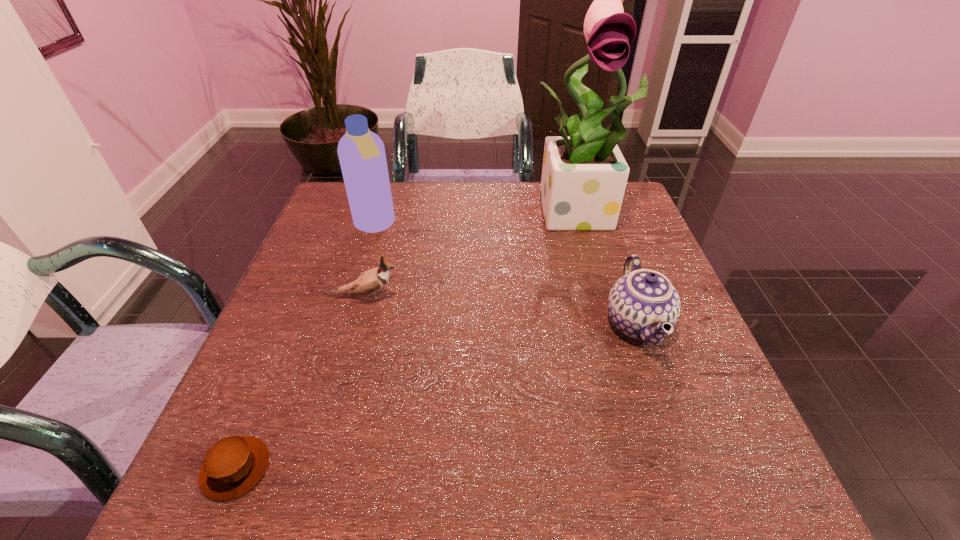
Locate an element on the screen. The height and width of the screenshot is (540, 960). free spot that satisfies the following two spatial constraints: 1. on the front-facing side of the tallest object; 2. at the face of the bird is located at coordinates (609, 296).

Where is `blank space that satisfies the following two spatial constraints: 1. at the face of the bird; 2. on the front side of the shortest object`? The width and height of the screenshot is (960, 540). blank space that satisfies the following two spatial constraints: 1. at the face of the bird; 2. on the front side of the shortest object is located at coordinates (315, 468).

Identify the location of vacant position in the image that satisfies the following two spatial constraints: 1. on the front-facing side of the flower arrangement; 2. at the face of the bird. (609, 296).

Find the location of a particular element. This screenshot has height=540, width=960. free region that satisfies the following two spatial constraints: 1. on the front-facing side of the tallest object; 2. at the face of the bird is located at coordinates (609, 296).